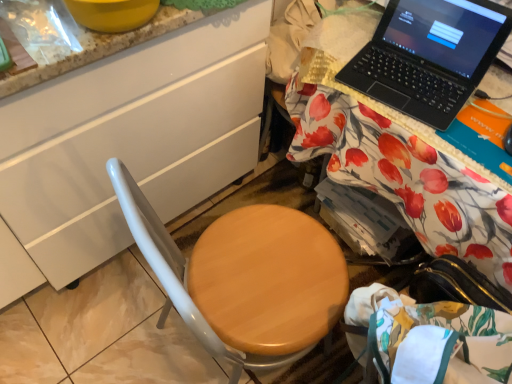
Describe the element at coordinates (131, 138) in the screenshot. I see `white glossy cabinet at left` at that location.

The height and width of the screenshot is (384, 512). Find the location of `white glossy cabinet at left`. white glossy cabinet at left is located at coordinates (131, 138).

The width and height of the screenshot is (512, 384). In order to click on black plastic laptop at upper right in this screenshot , I will do `click(429, 56)`.

In the image, is black plastic laptop at upper right on the left side or the right side of wooden at right?

black plastic laptop at upper right is to the left of wooden at right.

Is point (458, 64) farther from camera compared to point (377, 133)?

Yes, it is.

What's the angular difference between black plastic laptop at upper right and wooden at right's facing directions?

There is a 9.54-degree angle between the facing directions of black plastic laptop at upper right and wooden at right.

From the image's perspective, between black plastic laptop at upper right and wooden at right, which one is located above?

black plastic laptop at upper right, from the image's perspective.

Find the location of `cabinetry on the left side of wooden at right`. cabinetry on the left side of wooden at right is located at coordinates (131, 138).

From the picture: From the image's perspective, between white glossy cabinet at left and wooden at right, which one is located above?

From the image's view, white glossy cabinet at left is above.

From a real-world perspective, does white glossy cabinet at left sit lower than wooden at right?

Actually, white glossy cabinet at left is physically above wooden at right in the real world.

Who is shorter, white glossy cabinet at left or wooden at right?

wooden at right is shorter.

Can you confirm if white glossy cabinet at left is positioned to the left of black plastic laptop at upper right?

Yes, white glossy cabinet at left is to the left of black plastic laptop at upper right.

Which object is wider, white glossy cabinet at left or black plastic laptop at upper right?

white glossy cabinet at left.

Is white glossy cabinet at left taller than black plastic laptop at upper right?

Indeed, white glossy cabinet at left has a greater height compared to black plastic laptop at upper right.

There is a white glossy cabinet at left. Where is `laptop above it (from a real-world perspective)`? Image resolution: width=512 pixels, height=384 pixels. laptop above it (from a real-world perspective) is located at coordinates (429, 56).

Based on their positions, is wooden at right located to the left or right of white glossy cabinet at left?

wooden at right is positioned on white glossy cabinet at left's right side.

Does wooden at right turn towards white glossy cabinet at left?

No, wooden at right is not facing towards white glossy cabinet at left.

What's the angular difference between wooden at right and white glossy cabinet at left's facing directions?

wooden at right and white glossy cabinet at left are facing 88 degrees away from each other.

Who is taller, wooden at right or white glossy cabinet at left?

Standing taller between the two is white glossy cabinet at left.

Which object is closer to the camera, black plastic laptop at upper right or white glossy cabinet at left?

white glossy cabinet at left is in front.

Would you say black plastic laptop at upper right is inside or outside white glossy cabinet at left?

black plastic laptop at upper right is located beyond the bounds of white glossy cabinet at left.

Where is `laptop behind the white glossy cabinet at left`? This screenshot has width=512, height=384. laptop behind the white glossy cabinet at left is located at coordinates (429, 56).

From the image's perspective, who appears lower, black plastic laptop at upper right or white glossy cabinet at left?

white glossy cabinet at left appears lower in the image.

Which is more to the right, wooden at right or black plastic laptop at upper right?

wooden at right.

Is wooden at right smaller than black plastic laptop at upper right?

Actually, wooden at right might be larger than black plastic laptop at upper right.

Which object is closer to the camera, wooden at right or black plastic laptop at upper right?

Positioned in front is wooden at right.

Is wooden at right looking in the opposite direction of black plastic laptop at upper right?

No.

Identify the location of laptop above the wooden at right (from a real-world perspective). (429, 56).

The image size is (512, 384). What are the coordinates of `cabinetry that appears on the left of wooden at right` in the screenshot? It's located at (131, 138).

Based on their spatial positions, is black plastic laptop at upper right or white glossy cabinet at left closer to wooden at right?

Based on the image, black plastic laptop at upper right appears to be nearer to wooden at right.

Considering their positions, is wooden at right positioned closer to white glossy cabinet at left than black plastic laptop at upper right?

The object closer to white glossy cabinet at left is wooden at right.

When comparing their distances from black plastic laptop at upper right, does wooden at right or white glossy cabinet at left seem further?

white glossy cabinet at left lies further to black plastic laptop at upper right than the other object.

Looking at the image, which one is located closer to wooden at right, white glossy cabinet at left or black plastic laptop at upper right?

black plastic laptop at upper right lies closer to wooden at right than the other object.

In the scene shown: Based on their spatial positions, is black plastic laptop at upper right or wooden at right further from white glossy cabinet at left?

black plastic laptop at upper right.

From the image, which object appears to be nearer to black plastic laptop at upper right, white glossy cabinet at left or wooden at right?

wooden at right is positioned closer to the anchor black plastic laptop at upper right.

Where is `laptop between white glossy cabinet at left and wooden at right`? The width and height of the screenshot is (512, 384). laptop between white glossy cabinet at left and wooden at right is located at coordinates (429, 56).